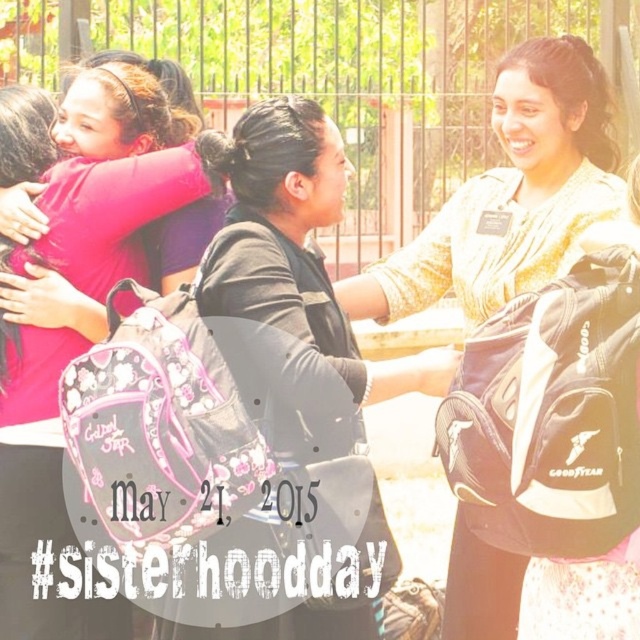
Question: Which is farther from the pink fabric at left?

Choices:
 (A) matte black backpack at center
 (B) black matte backpack at center

Answer: (A)

Question: Is the position of matte black backpack at center more distant than that of black matte backpack at center?

Choices:
 (A) no
 (B) yes

Answer: (B)

Question: Can you confirm if pink fabric at left is positioned above black matte backpack at center?

Choices:
 (A) yes
 (B) no

Answer: (B)

Question: Considering the real-world distances, which object is farthest from the matte black backpack at center?

Choices:
 (A) pink fabric at left
 (B) black matte backpack at center

Answer: (A)

Question: Which is farther from the black matte backpack at center?

Choices:
 (A) matte black backpack at center
 (B) pink fabric at left

Answer: (B)

Question: Does matte black backpack at center come behind pink fabric at left?

Choices:
 (A) yes
 (B) no

Answer: (A)